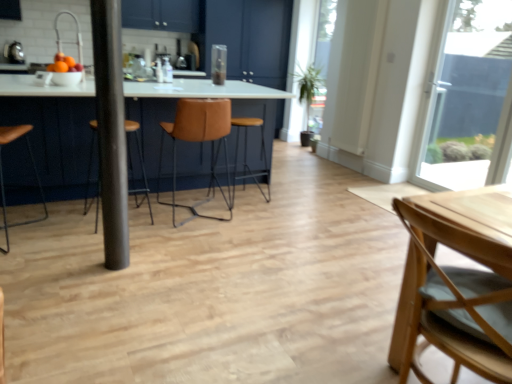
Question: Considering the relative sizes of leather seat at center and metallic silver toaster at upper left in the image provided, is leather seat at center taller than metallic silver toaster at upper left?

Choices:
 (A) no
 (B) yes

Answer: (B)

Question: Does leather seat at center turn towards metallic silver toaster at upper left?

Choices:
 (A) no
 (B) yes

Answer: (A)

Question: From the image's perspective, is leather seat at center above metallic silver toaster at upper left?

Choices:
 (A) no
 (B) yes

Answer: (A)

Question: Does leather seat at center appear on the left side of metallic silver toaster at upper left?

Choices:
 (A) no
 (B) yes

Answer: (A)

Question: Is leather seat at center not near metallic silver toaster at upper left?

Choices:
 (A) no
 (B) yes

Answer: (B)

Question: In terms of size, does matte white table at center appear bigger or smaller than transparent glass window at upper right?

Choices:
 (A) small
 (B) big

Answer: (B)

Question: In the image, is matte white table at center on the left side or the right side of transparent glass window at upper right?

Choices:
 (A) left
 (B) right

Answer: (A)

Question: From the image's perspective, is matte white table at center positioned above or below transparent glass window at upper right?

Choices:
 (A) above
 (B) below

Answer: (B)

Question: Is point (74, 89) positioned closer to the camera than point (439, 148)?

Choices:
 (A) closer
 (B) farther

Answer: (A)

Question: Relative to metallic silver toaster at upper left, is white matte door at upper right in front or behind?

Choices:
 (A) front
 (B) behind

Answer: (A)

Question: From the image's perspective, is white matte door at upper right positioned above or below metallic silver toaster at upper left?

Choices:
 (A) below
 (B) above

Answer: (A)

Question: Is white matte door at upper right spatially inside metallic silver toaster at upper left, or outside of it?

Choices:
 (A) outside
 (B) inside

Answer: (A)

Question: Is point (354, 150) closer or farther from the camera than point (24, 61)?

Choices:
 (A) farther
 (B) closer

Answer: (A)

Question: Is metallic pole at center wider or thinner than matte white table at center?

Choices:
 (A) wide
 (B) thin

Answer: (B)

Question: From the image's perspective, relative to matte white table at center, is metallic pole at center above or below?

Choices:
 (A) below
 (B) above

Answer: (A)